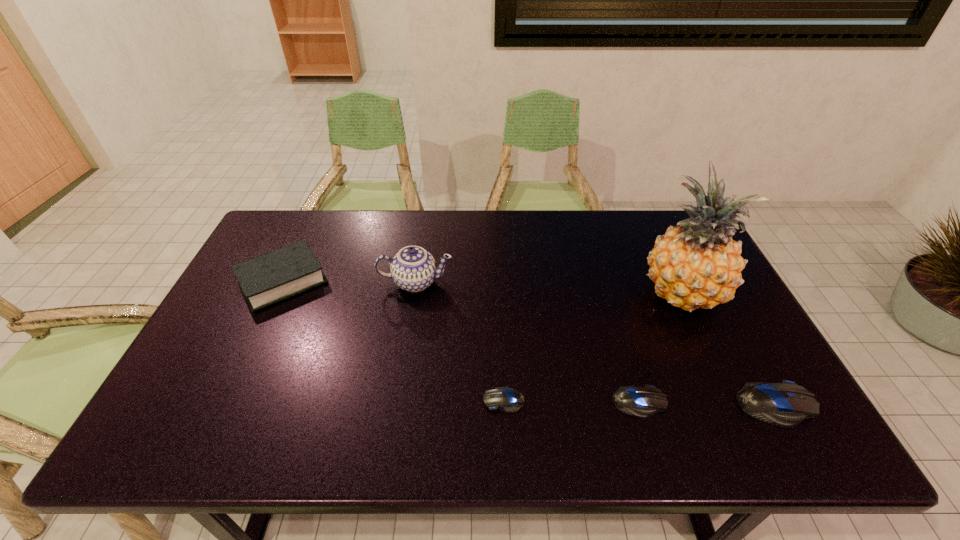
Find the location of a particular element. The height and width of the screenshot is (540, 960). the shortest object is located at coordinates (509, 400).

Locate an element on the screen. The image size is (960, 540). the leftmost computer mouse is located at coordinates (509, 400).

At what (x,y) coordinates should I click in order to perform the action: click on the second tallest computer mouse. Please return your answer as a coordinate pair (x, y). This screenshot has width=960, height=540. Looking at the image, I should click on (642, 402).

Find the location of `the second computer mouse from left to right`. the second computer mouse from left to right is located at coordinates (642, 402).

At what (x,y) coordinates should I click in order to perform the action: click on the fourth tallest object. Please return your answer as a coordinate pair (x, y). Looking at the image, I should click on (786, 404).

The height and width of the screenshot is (540, 960). In order to click on the rightmost computer mouse in this screenshot , I will do `click(786, 404)`.

At what (x,y) coordinates should I click in order to perform the action: click on the second tallest object. Please return your answer as a coordinate pair (x, y). Looking at the image, I should click on (413, 269).

Image resolution: width=960 pixels, height=540 pixels. Identify the location of the second object from left to right. (413, 269).

Identify the location of pineapple. (697, 265).

Where is `Bible`? This screenshot has width=960, height=540. Bible is located at coordinates (269, 278).